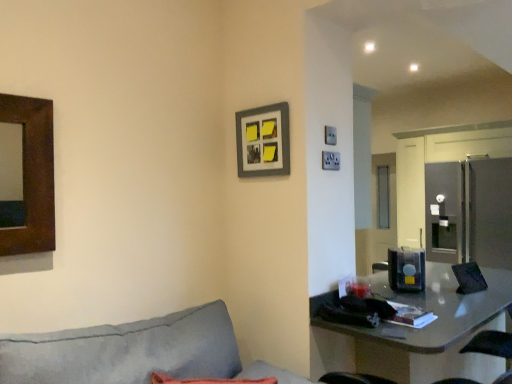
Describe the element at coordinates (416, 332) in the screenshot. I see `matte gray table at lower right` at that location.

Image resolution: width=512 pixels, height=384 pixels. What do you see at coordinates (406, 269) in the screenshot?
I see `translucent plastic container at center` at bounding box center [406, 269].

What are the coordinates of `matte gray picture frame at upper center` in the screenshot? It's located at (263, 141).

Identify the location of matte gray table at lower right. (x=416, y=332).

Is point (414, 259) farther from camera compared to point (466, 327)?

Yes, point (414, 259) is behind point (466, 327).

Considering the relative positions of translucent plastic container at center and matte gray table at lower right in the image provided, is translucent plastic container at center in front of matte gray table at lower right?

No, translucent plastic container at center is further to the viewer.

Considering the relative positions of translucent plastic container at center and matte gray table at lower right in the image provided, is translucent plastic container at center to the left of matte gray table at lower right from the viewer's perspective?

Correct, you'll find translucent plastic container at center to the left of matte gray table at lower right.

From a real-world perspective, is translucent plastic container at center physically located above or below matte gray table at lower right?

From a real-world perspective, translucent plastic container at center is physically above matte gray table at lower right.

How far apart are matte gray picture frame at upper center and matte gray table at lower right?

matte gray picture frame at upper center is 1.02 meters away from matte gray table at lower right.

Is matte gray table at lower right a part of matte gray picture frame at upper center?

No.

Is matte gray picture frame at upper center oriented away from matte gray table at lower right?

No, matte gray picture frame at upper center's orientation is not away from matte gray table at lower right.

Can you confirm if matte gray picture frame at upper center is wider than matte gray table at lower right?

→ In fact, matte gray picture frame at upper center might be narrower than matte gray table at lower right.

Visually, is matte gray picture frame at upper center positioned to the left or to the right of translucent plastic container at center?

Based on their positions, matte gray picture frame at upper center is located to the left of translucent plastic container at center.

Between matte gray picture frame at upper center and translucent plastic container at center, which one has larger size?

With larger size is translucent plastic container at center.

From the image's perspective, which one is positioned higher, matte gray picture frame at upper center or translucent plastic container at center?

matte gray picture frame at upper center is shown above in the image.

In the scene shown: From a real-world perspective, between matte gray picture frame at upper center and translucent plastic container at center, who is vertically higher?

matte gray picture frame at upper center is physically above.

Could translucent plastic container at center be considered to be inside matte gray table at lower right?

No, translucent plastic container at center is not inside matte gray table at lower right.

Can you tell me how much matte gray table at lower right and translucent plastic container at center differ in facing direction?

There is a 59.6-degree angle between the facing directions of matte gray table at lower right and translucent plastic container at center.

From the picture: From a real-world perspective, is matte gray table at lower right on translucent plastic container at center?

Incorrect, from a real-world perspective, matte gray table at lower right is lower than translucent plastic container at center.

Does matte gray table at lower right have a larger size compared to translucent plastic container at center?

Indeed, matte gray table at lower right has a larger size compared to translucent plastic container at center.

Can you confirm if matte gray table at lower right is positioned to the left of matte gray picture frame at upper center?

In fact, matte gray table at lower right is to the right of matte gray picture frame at upper center.

Consider the image. Is matte gray table at lower right not inside matte gray picture frame at upper center?

Yes, matte gray table at lower right is outside of matte gray picture frame at upper center.

Is matte gray table at lower right directly adjacent to matte gray picture frame at upper center?

No, matte gray table at lower right is not beside matte gray picture frame at upper center.

How much distance is there between translucent plastic container at center and matte gray picture frame at upper center?

The distance of translucent plastic container at center from matte gray picture frame at upper center is 1.09 meters.

From the image's perspective, does translucent plastic container at center appear lower than matte gray picture frame at upper center?

Correct, translucent plastic container at center appears lower than matte gray picture frame at upper center in the image.

Locate an element on the screen. appliance below the matte gray picture frame at upper center (from the image's perspective) is located at coordinates (406, 269).

Considering the positions of point (420, 252) and point (273, 152), is point (420, 252) closer or farther from the camera than point (273, 152)?

Point (420, 252).

The height and width of the screenshot is (384, 512). I want to click on appliance above the matte gray table at lower right (from the image's perspective), so click(x=406, y=269).

Where is `table in front of the matte gray picture frame at upper center`? The width and height of the screenshot is (512, 384). table in front of the matte gray picture frame at upper center is located at coordinates (416, 332).

Based on their spatial positions, is translucent plastic container at center or matte gray picture frame at upper center closer to matte gray table at lower right?

translucent plastic container at center is closer to matte gray table at lower right.

Estimate the real-world distances between objects in this image. Which object is closer to matte gray table at lower right, matte gray picture frame at upper center or translucent plastic container at center?

The object closer to matte gray table at lower right is translucent plastic container at center.

Based on the photo, when comparing their distances from translucent plastic container at center, does matte gray picture frame at upper center or matte gray table at lower right seem closer?

matte gray table at lower right is closer to translucent plastic container at center.

Considering their positions, is translucent plastic container at center positioned further to matte gray picture frame at upper center than matte gray table at lower right?

translucent plastic container at center is positioned further to the anchor matte gray picture frame at upper center.

When comparing their distances from translucent plastic container at center, does matte gray table at lower right or matte gray picture frame at upper center seem closer?

matte gray table at lower right.

Which object lies further to the anchor point matte gray picture frame at upper center, matte gray table at lower right or translucent plastic container at center?

translucent plastic container at center is positioned further to the anchor matte gray picture frame at upper center.

Find the location of a particular element. The width and height of the screenshot is (512, 384). appliance between matte gray picture frame at upper center and matte gray table at lower right vertically is located at coordinates (406, 269).